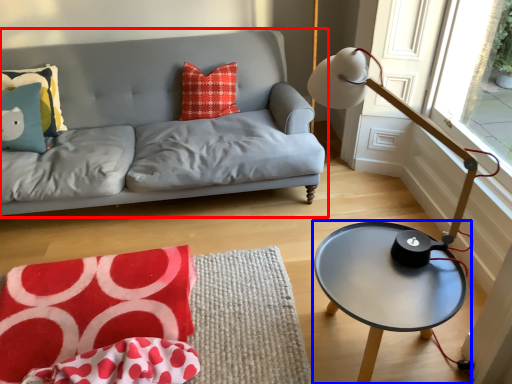
Question: Which object appears closest to the camera in this image, studio couch (highlighted by a red box) or coffee table (highlighted by a blue box)?

Choices:
 (A) studio couch
 (B) coffee table

Answer: (B)